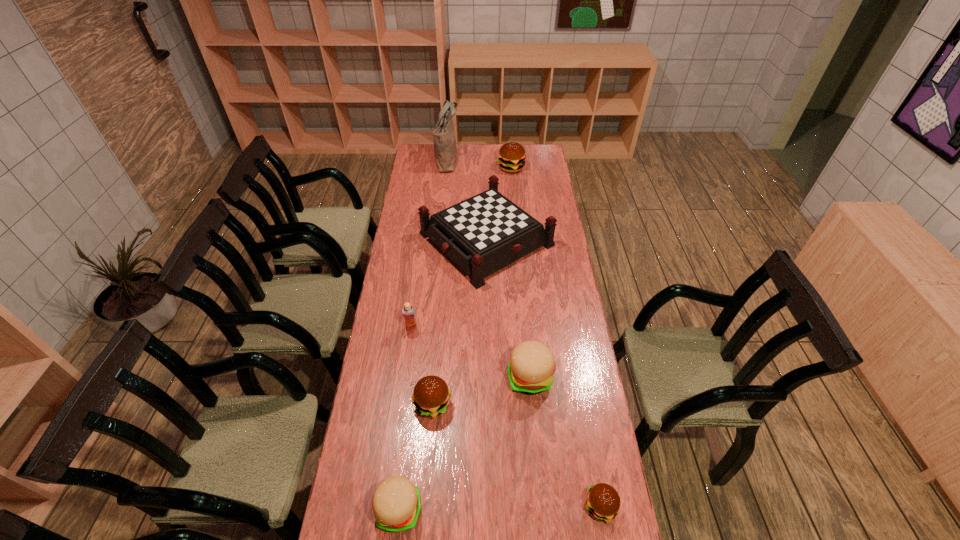
Identify the location of object that is at the far left corner. The height and width of the screenshot is (540, 960). (445, 151).

Identify the location of object present at the far right corner. (511, 157).

In the image, there is a desktop. At what (x,y) coordinates should I click in order to perform the action: click on vacant region at the left edge. Please return your answer as a coordinate pair (x, y). Looking at the image, I should click on (433, 205).

Identify the location of blank space at the right edge. Image resolution: width=960 pixels, height=540 pixels. (541, 208).

In the image, there is a desktop. Where is `free space at the far left corner`? This screenshot has height=540, width=960. free space at the far left corner is located at coordinates (423, 154).

Where is `blank area at the far right corner`? The width and height of the screenshot is (960, 540). blank area at the far right corner is located at coordinates (530, 150).

Where is `blank region between the second nearest brown hamburger and the tallest object`? The width and height of the screenshot is (960, 540). blank region between the second nearest brown hamburger and the tallest object is located at coordinates (440, 282).

Find the location of a particular element. The width and height of the screenshot is (960, 540). free space between the checkerboard and the left beige hamburger is located at coordinates (443, 374).

Locate an element on the screen. The image size is (960, 540). vacant space that's between the second biggest brown hamburger and the smaller beige hamburger is located at coordinates (416, 457).

The width and height of the screenshot is (960, 540). I want to click on free point between the checkerboard and the fifth nearest object, so click(449, 284).